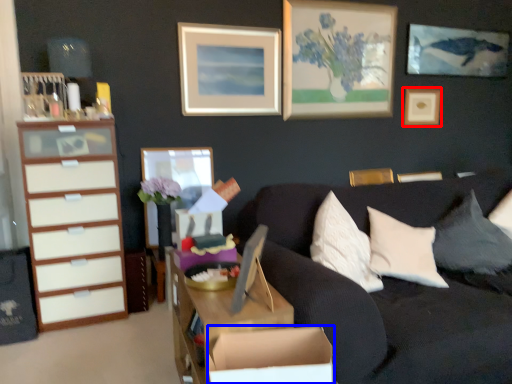
Question: Among these objects, which one is nearest to the camera, picture frame (highlighted by a red box) or cardboard box (highlighted by a blue box)?

Choices:
 (A) picture frame
 (B) cardboard box

Answer: (B)